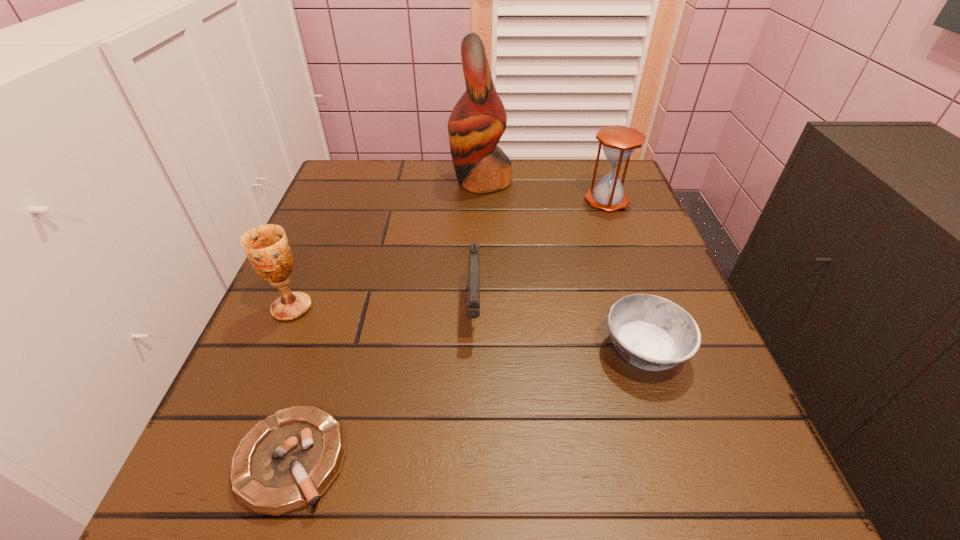
Where is `parrot`? parrot is located at coordinates (477, 122).

Identify the location of hourglass. The width and height of the screenshot is (960, 540). (x=619, y=142).

Find the location of a particular element. chalice is located at coordinates (266, 246).

Identify the location of the fourth tallest object. coord(473,300).

Identify the location of the second shortest object. (650, 332).

The height and width of the screenshot is (540, 960). Find the location of `the right ashtray`. the right ashtray is located at coordinates (650, 332).

The image size is (960, 540). What are the coordinates of `the nearest object` in the screenshot? It's located at (286, 462).

In order to click on the nearer ashtray in this screenshot , I will do `click(286, 462)`.

The width and height of the screenshot is (960, 540). What are the coordinates of `blank space located on the face of the parrot` in the screenshot? It's located at (340, 181).

This screenshot has width=960, height=540. Find the location of `vacant space located on the face of the parrot`. vacant space located on the face of the parrot is located at coordinates (415, 181).